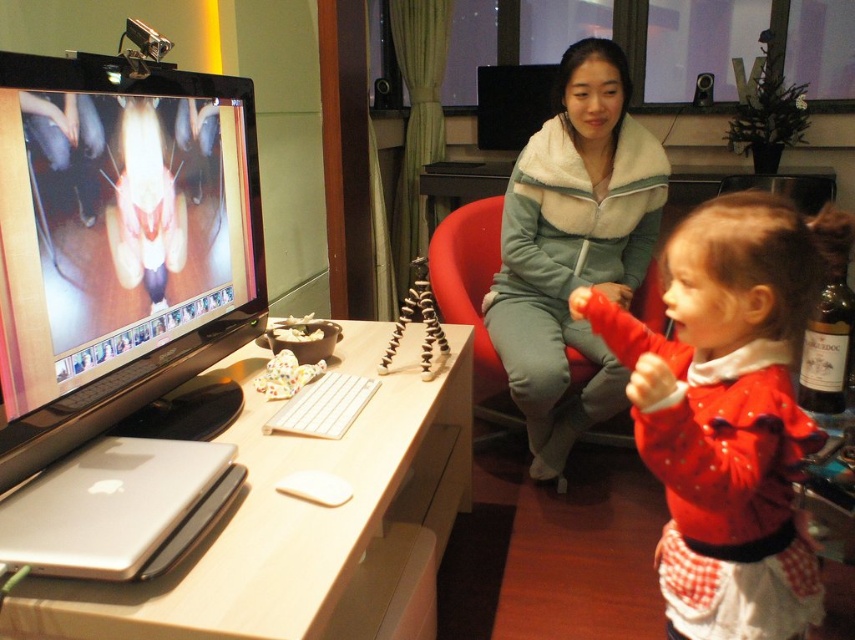
The height and width of the screenshot is (640, 855). Describe the element at coordinates (573, 248) in the screenshot. I see `light green fleece jacket at center` at that location.

Between point (624, 390) and point (529, 88), which one is positioned behind?

The point (529, 88) is behind.

Describe the element at coordinates (573, 248) in the screenshot. The image size is (855, 640). I see `light green fleece jacket at center` at that location.

I want to click on light green fleece jacket at center, so click(573, 248).

Is red velvet dress at lower right thinner than red fabric swivel chair at center?

Indeed, red velvet dress at lower right has a lesser width compared to red fabric swivel chair at center.

Can you confirm if red velvet dress at lower right is positioned below red fabric swivel chair at center?

Indeed, red velvet dress at lower right is positioned under red fabric swivel chair at center.

The height and width of the screenshot is (640, 855). I want to click on red velvet dress at lower right, so click(729, 412).

Where is `matte black monitor at left`? This screenshot has width=855, height=640. matte black monitor at left is located at coordinates (116, 243).

Does point (161, 264) come behind point (775, 600)?

Yes, point (161, 264) is farther from viewer.

Is point (109, 205) in front of point (793, 252)?

No.

Identify the location of matte black monitor at left. (116, 243).